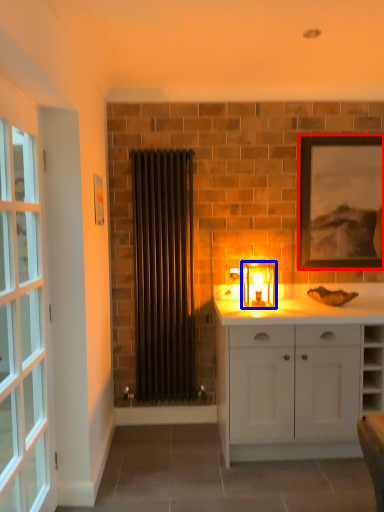
Question: Which point is closer to the camera, picture frame (highlighted by a red box) or candle holder (highlighted by a blue box)?

Choices:
 (A) picture frame
 (B) candle holder

Answer: (B)